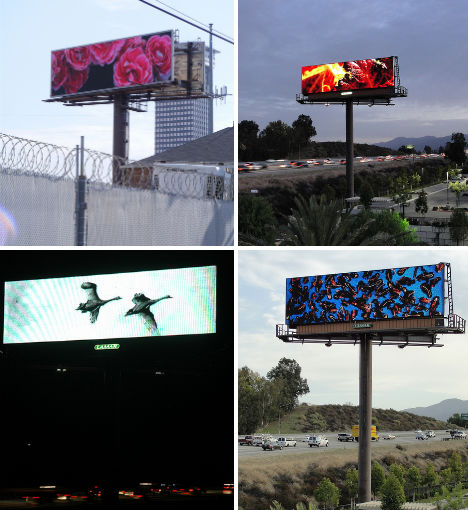
Locate an element on the screen. The width and height of the screenshot is (468, 510). screen is located at coordinates (104, 311).